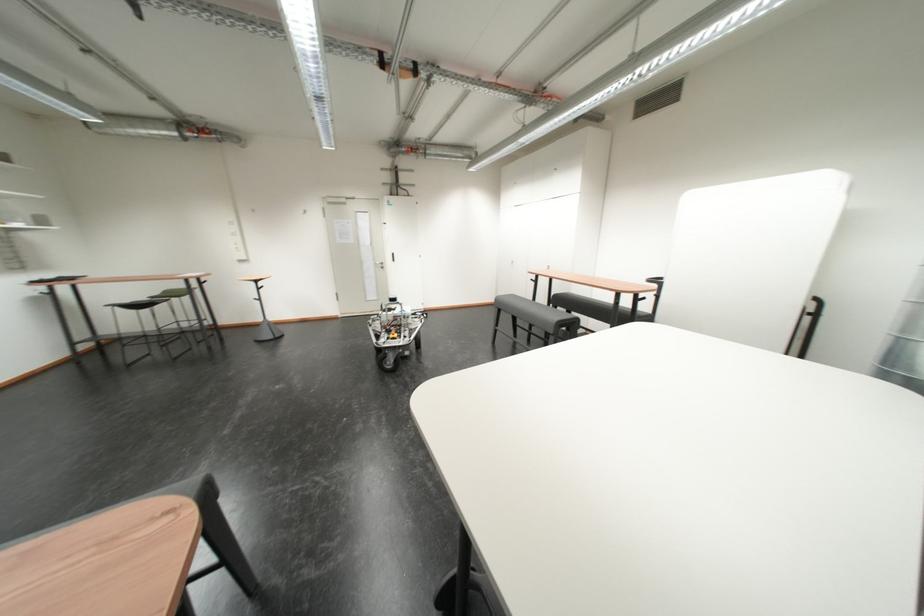
This screenshot has height=616, width=924. What are the coordinates of `grey sofa sitting surface` in the screenshot? It's located at (533, 313).